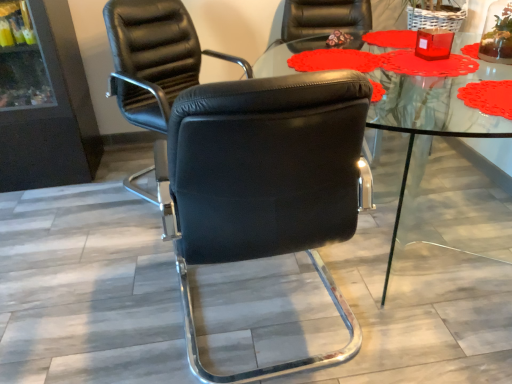
Identify the location of blank area to the left of black leather chair at center, which ranks as the 2th chair in front-to-back order. (78, 213).